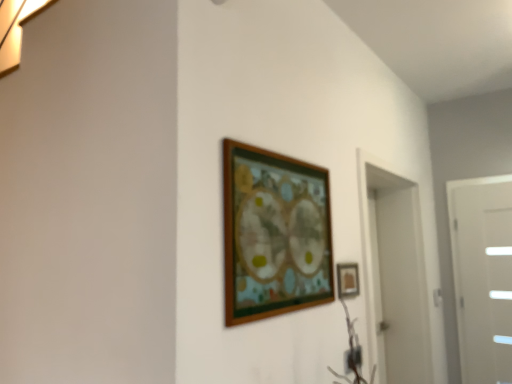
Question: Is wooden picture frame at center, marked as the second picture frame in a right-to-left arrangement, situated inside white glossy door at right or outside?

Choices:
 (A) outside
 (B) inside

Answer: (A)

Question: From a real-world perspective, is wooden picture frame at center, the 1th picture frame in the left-to-right sequence, physically located above or below white glossy door at right?

Choices:
 (A) below
 (B) above

Answer: (B)

Question: Which of these objects is positioned farthest from the white glossy door at right?

Choices:
 (A) matte gold picture frame at center-right, positioned as the 1th picture frame in back-to-front order
 (B) wooden picture frame at center, which appears as the first picture frame when viewed from the front

Answer: (B)

Question: Based on their relative distances, which object is nearer to the wooden picture frame at center, the 1th picture frame in the left-to-right sequence?

Choices:
 (A) white glossy door at right
 (B) matte gold picture frame at center-right, positioned as the 1th picture frame in back-to-front order

Answer: (B)